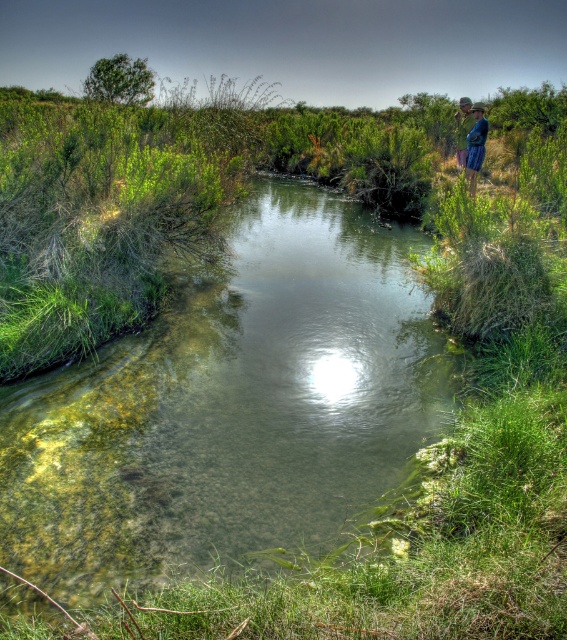
You are a hiker who wants to cross the stream. You see the clear water at upper center and the blue denim jeans at upper right. Which object is closer to you as you stand on the bank?

The clear water at upper center is closer to you because it is in front of the blue denim jeans at upper right.

You are standing at the edge of the stream and want to cross to the other side. You see the clear water at upper center and the blue denim jeans at upper right. How far apart are these two objects from each other?

The clear water at upper center and the blue denim jeans at upper right are 9.27 meters apart from each other.

You are planning to cross the stream using the blue denim jeans at upper right. Considering the clear water at upper center, which area would be more suitable for crossing? Please explain based on the space they occupy.

The blue denim jeans at upper right occupies more space than the clear water at upper center according to the description. Therefore, the blue denim jeans at upper right might provide a wider or more stable area for crossing the stream compared to the clear water at upper center.